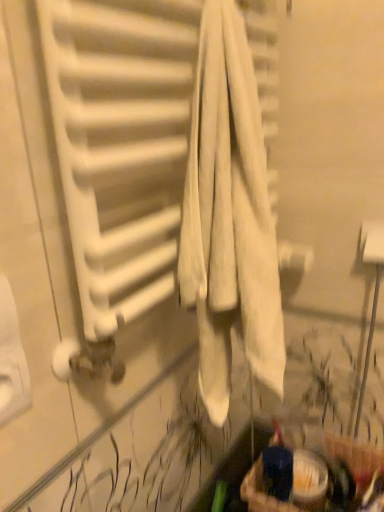
Question: Should I look upward or downward to see matte brown basket at lower right?

Choices:
 (A) up
 (B) down

Answer: (B)

Question: Does white matte radiator at center have a greater width compared to matte brown basket at lower right?

Choices:
 (A) no
 (B) yes

Answer: (B)

Question: From the image's perspective, is white matte radiator at center on top of matte brown basket at lower right?

Choices:
 (A) yes
 (B) no

Answer: (A)

Question: Is white matte radiator at center further to camera compared to matte brown basket at lower right?

Choices:
 (A) yes
 (B) no

Answer: (B)

Question: From a real-world perspective, is white matte radiator at center below matte brown basket at lower right?

Choices:
 (A) no
 (B) yes

Answer: (A)

Question: From the image's perspective, is white matte radiator at center under matte brown basket at lower right?

Choices:
 (A) no
 (B) yes

Answer: (A)

Question: Can you confirm if white matte radiator at center is thinner than matte brown basket at lower right?

Choices:
 (A) no
 (B) yes

Answer: (A)

Question: Would you consider matte brown basket at lower right to be distant from white matte radiator at center?

Choices:
 (A) yes
 (B) no

Answer: (B)

Question: Is matte brown basket at lower right positioned beyond the bounds of white matte radiator at center?

Choices:
 (A) yes
 (B) no

Answer: (A)

Question: Is matte brown basket at lower right positioned in front of white matte radiator at center?

Choices:
 (A) yes
 (B) no

Answer: (B)

Question: Can you confirm if matte brown basket at lower right is positioned to the left of white matte radiator at center?

Choices:
 (A) no
 (B) yes

Answer: (A)

Question: Does matte brown basket at lower right have a lesser width compared to white matte radiator at center?

Choices:
 (A) no
 (B) yes

Answer: (B)

Question: Does matte brown basket at lower right appear on the right side of white matte radiator at center?

Choices:
 (A) yes
 (B) no

Answer: (A)

Question: Is matte brown basket at lower right inside the boundaries of white matte radiator at center, or outside?

Choices:
 (A) outside
 (B) inside

Answer: (A)